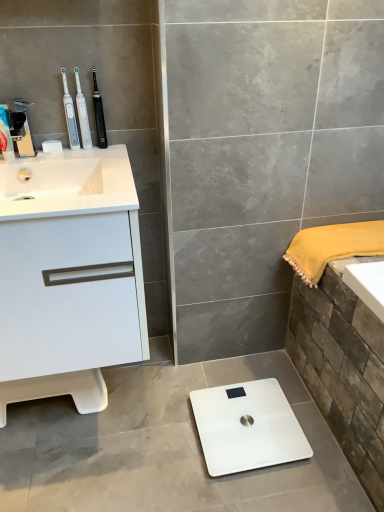
Where is `empty space that is ontop of white glossy scale at center (from a real-world perspective)`? This screenshot has height=512, width=384. empty space that is ontop of white glossy scale at center (from a real-world perspective) is located at coordinates pyautogui.click(x=241, y=420).